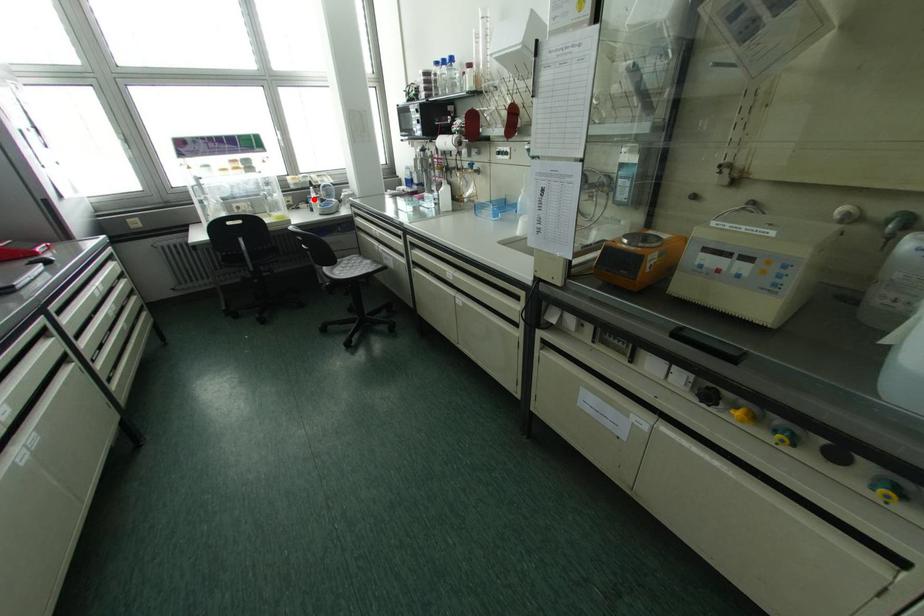
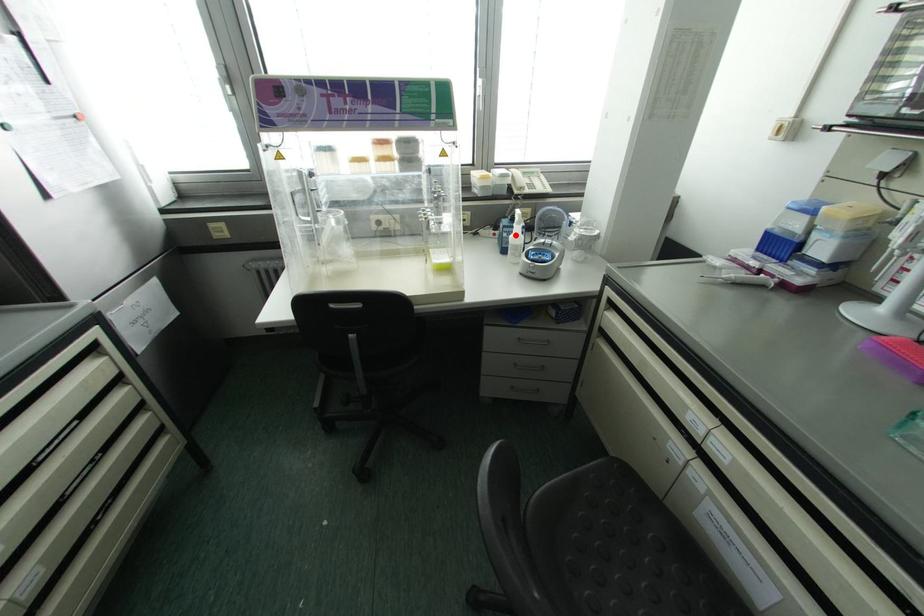
I am providing you with two images of the same scene from different viewpoints. A red point is marked on the first image and another point is marked on the second image. Are the points marked in image1 and image2 representing the same 3D position?

Yes